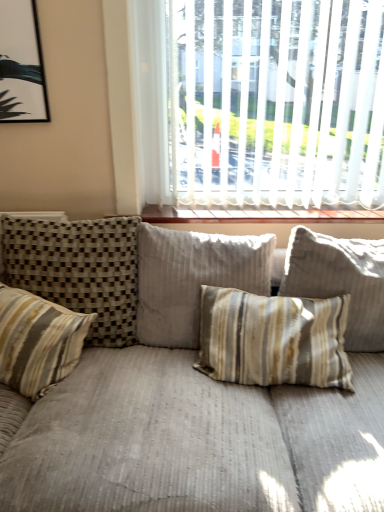
The height and width of the screenshot is (512, 384). I want to click on white blinds at upper center, so 263,102.

What do you see at coordinates (79, 270) in the screenshot? The height and width of the screenshot is (512, 384). I see `striped fabric pillow at left, which appears as the second pillow when viewed from the left` at bounding box center [79, 270].

The image size is (384, 512). Identify the location of wooden at upper center. (257, 215).

In order to click on white blinds at upper center in this screenshot , I will do `click(263, 102)`.

Choose the correct answer: Is striped fabric pillow at left, which ranks as the third pillow in right-to-left order, inside wooden at upper center or outside it?

The correct answer is: outside.

Between striped fabric pillow at left, which appears as the second pillow when viewed from the left, and wooden at upper center, which one appears on the right side from the viewer's perspective?

wooden at upper center is more to the right.

Is striped fabric pillow at left, which ranks as the third pillow in right-to-left order, next to wooden at upper center?

No.

Is striped fabric pillow at left, which ranks as the third pillow in right-to-left order, turned away from wooden at upper center?

No, striped fabric pillow at left, which ranks as the third pillow in right-to-left order, is not facing the opposite direction of wooden at upper center.

From the image's perspective, between wooden at upper center and striped fabric pillow at center, the 1th pillow from the right, which one is located above?

wooden at upper center.

Where is `the 2nd pillow below when counting from the wooden at upper center (from the image's perspective)`? the 2nd pillow below when counting from the wooden at upper center (from the image's perspective) is located at coordinates (340, 281).

Consider the image. Can you tell me how much wooden at upper center and striped fabric pillow at center, positioned as the 4th pillow in left-to-right order, differ in facing direction?

6.33 degrees.

From a real-world perspective, is wooden at upper center under striped fabric pillow at center, the 1th pillow from the right?

No, from a real-world perspective, wooden at upper center is not under striped fabric pillow at center, the 1th pillow from the right.

From the image's perspective, relative to white blinds at upper center, is wooden at upper center above or below?

Clearly, from the image's perspective, wooden at upper center is below white blinds at upper center.

Is wooden at upper center not close to white blinds at upper center?

They are positioned close to each other.

Looking at the image, does wooden at upper center seem bigger or smaller compared to white blinds at upper center?

In the image, wooden at upper center appears to be smaller than white blinds at upper center.

Which is in front, striped fabric pillow at left, which appears as the fourth pillow when viewed from the right, or striped fabric pillow at left, which appears as the second pillow when viewed from the left?

striped fabric pillow at left, which appears as the fourth pillow when viewed from the right, is more forward.

Between striped fabric pillow at left, which appears as the fourth pillow when viewed from the right, and striped fabric pillow at left, which appears as the second pillow when viewed from the left, which one has less height?

With less height is striped fabric pillow at left, which appears as the fourth pillow when viewed from the right.

From a real-world perspective, is striped fabric pillow at left, arranged as the 1th pillow when viewed from the left, located higher than striped fabric pillow at left, which appears as the second pillow when viewed from the left?

Incorrect, from a real-world perspective, striped fabric pillow at left, arranged as the 1th pillow when viewed from the left, is lower than striped fabric pillow at left, which appears as the second pillow when viewed from the left.

Is there a large distance between striped fabric pillow at left, arranged as the 1th pillow when viewed from the left, and striped fabric pillow at left, which ranks as the third pillow in right-to-left order?

No, striped fabric pillow at left, arranged as the 1th pillow when viewed from the left, is not far from striped fabric pillow at left, which ranks as the third pillow in right-to-left order.

Which object is more forward, striped fabric pillow at center, the third pillow positioned from the left, or striped fabric pillow at left, which ranks as the third pillow in right-to-left order?

striped fabric pillow at left, which ranks as the third pillow in right-to-left order, is more forward.

Is striped fabric pillow at center, the second pillow from the right, looking in the opposite direction of striped fabric pillow at left, which ranks as the third pillow in right-to-left order?

No, striped fabric pillow at left, which ranks as the third pillow in right-to-left order, is not at the back of striped fabric pillow at center, the second pillow from the right.

Who is shorter, striped fabric pillow at center, the second pillow from the right, or striped fabric pillow at left, which ranks as the third pillow in right-to-left order?

striped fabric pillow at left, which ranks as the third pillow in right-to-left order, is shorter.

Is striped fabric pillow at center, the second pillow from the right, not within striped fabric pillow at left, which appears as the second pillow when viewed from the left?

Yes, striped fabric pillow at center, the second pillow from the right, is not within striped fabric pillow at left, which appears as the second pillow when viewed from the left.

Does white blinds at upper center have a greater height compared to striped fabric pillow at left, which appears as the fourth pillow when viewed from the right?

Indeed, white blinds at upper center has a greater height compared to striped fabric pillow at left, which appears as the fourth pillow when viewed from the right.

What's the angular difference between white blinds at upper center and striped fabric pillow at left, arranged as the 1th pillow when viewed from the left,'s facing directions?

There is a 17-degree angle between the facing directions of white blinds at upper center and striped fabric pillow at left, arranged as the 1th pillow when viewed from the left.

From the image's perspective, is white blinds at upper center located above or below striped fabric pillow at left, arranged as the 1th pillow when viewed from the left?

white blinds at upper center is above striped fabric pillow at left, arranged as the 1th pillow when viewed from the left.

Which is in front, point (235, 153) or point (46, 359)?

The point (46, 359) is closer to the camera.

Is striped fabric pillow at center, the 1th pillow from the right, next to striped fabric pillow at left, which appears as the second pillow when viewed from the left, and touching it?

striped fabric pillow at center, the 1th pillow from the right, and striped fabric pillow at left, which appears as the second pillow when viewed from the left, are clearly separated.

Considering the relative sizes of striped fabric pillow at center, positioned as the 4th pillow in left-to-right order, and striped fabric pillow at left, which ranks as the third pillow in right-to-left order, in the image provided, is striped fabric pillow at center, positioned as the 4th pillow in left-to-right order, taller than striped fabric pillow at left, which ranks as the third pillow in right-to-left order,?

Incorrect, the height of striped fabric pillow at center, positioned as the 4th pillow in left-to-right order, is not larger of that of striped fabric pillow at left, which ranks as the third pillow in right-to-left order.

From the image's perspective, which one is positioned higher, striped fabric pillow at center, the 1th pillow from the right, or striped fabric pillow at left, which appears as the second pillow when viewed from the left?

From the image's view, striped fabric pillow at left, which appears as the second pillow when viewed from the left, is above.

From the image's perspective, which pillow is the 1st one below the wooden at upper center? Please provide its 2D coordinates.

[(79, 270)]

This screenshot has height=512, width=384. I want to click on the 2nd pillow in front when counting from the wooden at upper center, so click(x=340, y=281).

From the image, which object appears to be nearer to striped fabric pillow at center, the 1th pillow from the right, striped fabric pillow at left, which ranks as the third pillow in right-to-left order, or wooden at upper center?

wooden at upper center is positioned closer to the anchor striped fabric pillow at center, the 1th pillow from the right.

Based on their spatial positions, is striped fabric pillow at center, the third pillow positioned from the left, or wooden at upper center further from striped fabric pillow at left, which appears as the fourth pillow when viewed from the right?

wooden at upper center.

Estimate the real-world distances between objects in this image. Which object is further from white blinds at upper center, wooden at upper center or striped fabric pillow at left, which appears as the second pillow when viewed from the left?

striped fabric pillow at left, which appears as the second pillow when viewed from the left.

When comparing their distances from striped fabric pillow at left, which appears as the second pillow when viewed from the left, does white blinds at upper center or striped fabric pillow at center, the third pillow positioned from the left, seem closer?

striped fabric pillow at center, the third pillow positioned from the left, is closer to striped fabric pillow at left, which appears as the second pillow when viewed from the left.

Which object lies nearer to the anchor point striped fabric pillow at center, the second pillow from the right, striped fabric pillow at center, positioned as the 4th pillow in left-to-right order, or striped fabric pillow at left, which ranks as the third pillow in right-to-left order?

striped fabric pillow at left, which ranks as the third pillow in right-to-left order, is closer to striped fabric pillow at center, the second pillow from the right.

From the picture: From the image, which object appears to be farther from striped fabric pillow at left, arranged as the 1th pillow when viewed from the left, striped fabric pillow at left, which appears as the second pillow when viewed from the left, or wooden at upper center?

wooden at upper center lies further to striped fabric pillow at left, arranged as the 1th pillow when viewed from the left, than the other object.

Based on their spatial positions, is striped fabric pillow at left, which appears as the second pillow when viewed from the left, or striped fabric pillow at center, the 1th pillow from the right, further from striped fabric pillow at left, arranged as the 1th pillow when viewed from the left?

Among the two, striped fabric pillow at center, the 1th pillow from the right, is located further to striped fabric pillow at left, arranged as the 1th pillow when viewed from the left.

Considering their positions, is wooden at upper center positioned closer to striped fabric pillow at center, positioned as the 4th pillow in left-to-right order, than striped fabric pillow at left, which appears as the fourth pillow when viewed from the right?

wooden at upper center is closer to striped fabric pillow at center, positioned as the 4th pillow in left-to-right order.

Image resolution: width=384 pixels, height=512 pixels. Identify the location of window sill between striped fabric pillow at center, the third pillow positioned from the left, and striped fabric pillow at center, positioned as the 4th pillow in left-to-right order. (257, 215).

Find the location of `window between striped fabric pillow at left, which appears as the second pillow when viewed from the left, and striped fabric pillow at center, positioned as the 4th pillow in left-to-right order`. window between striped fabric pillow at left, which appears as the second pillow when viewed from the left, and striped fabric pillow at center, positioned as the 4th pillow in left-to-right order is located at coordinates coord(263,102).

The width and height of the screenshot is (384, 512). Find the location of `pillow situated between striped fabric pillow at left, arranged as the 1th pillow when viewed from the left, and striped fabric pillow at center, the second pillow from the right, from left to right`. pillow situated between striped fabric pillow at left, arranged as the 1th pillow when viewed from the left, and striped fabric pillow at center, the second pillow from the right, from left to right is located at coordinates (79, 270).

What are the coordinates of `window sill between striped fabric pillow at left, which ranks as the third pillow in right-to-left order, and white blinds at upper center, in the horizontal direction` in the screenshot? It's located at (257, 215).